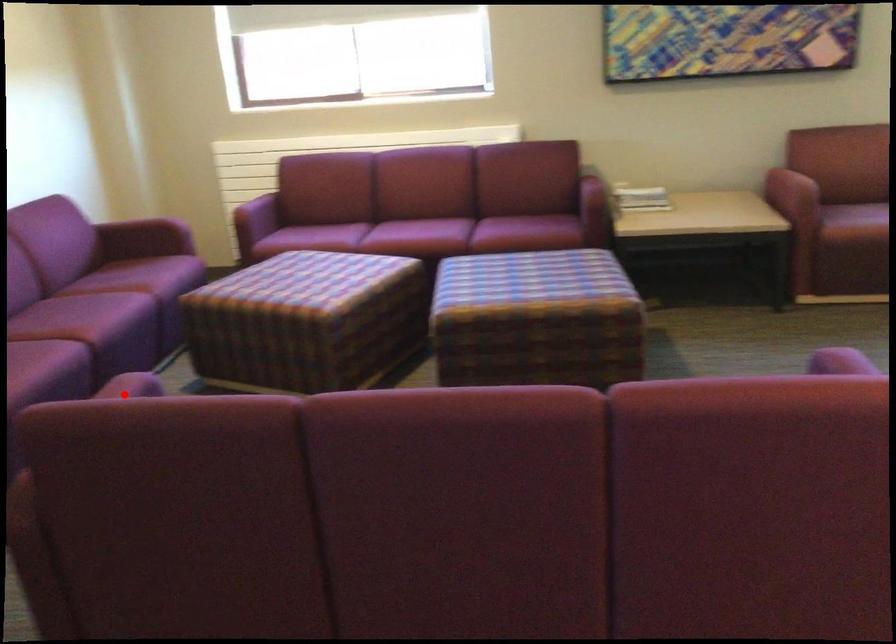
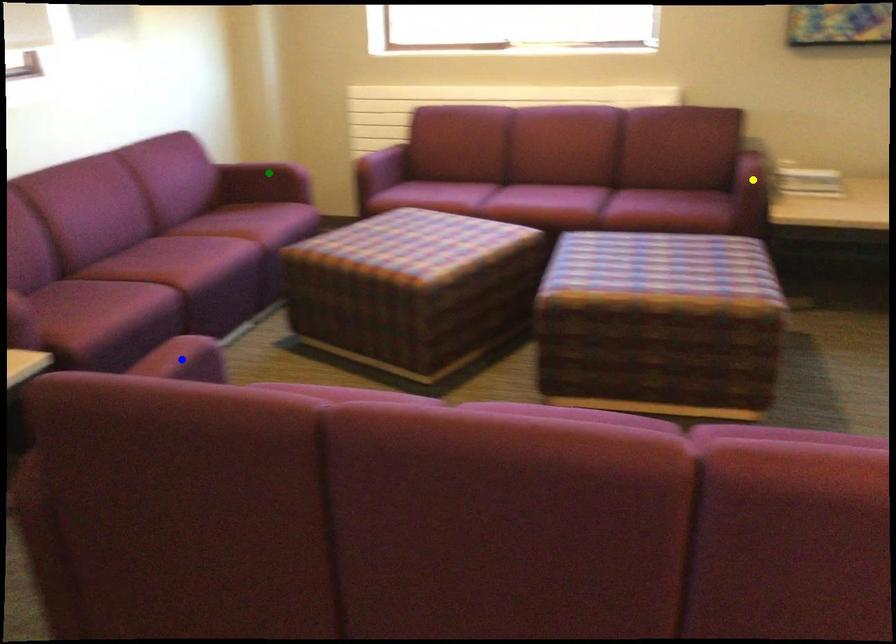
Question: I am providing you with two images of the same scene from different viewpoints. A red point is marked on the first image. You are given multiple points on the second image. Which mark in image 2 goes with the point in image 1?

Choices:
 (A) green point
 (B) yellow point
 (C) blue point

Answer: (C)